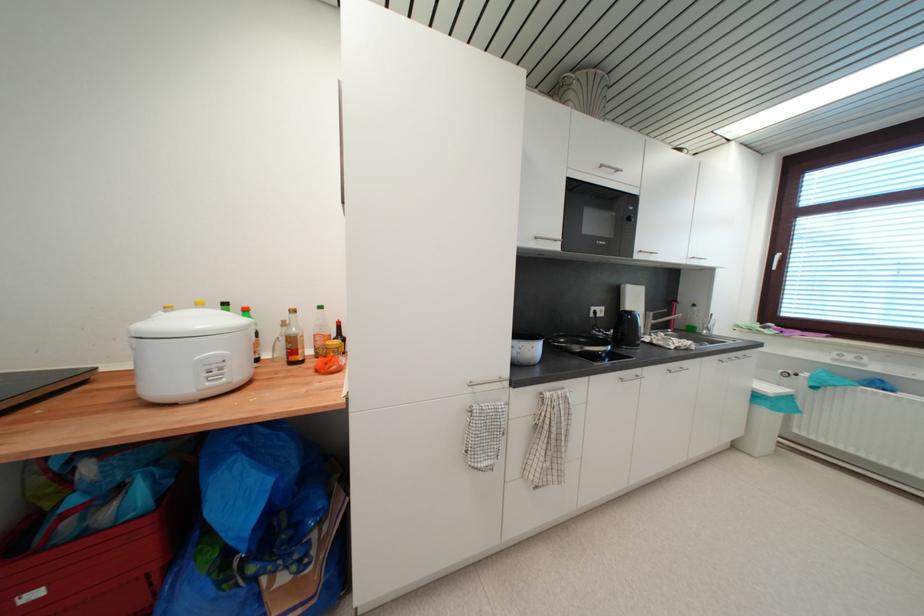
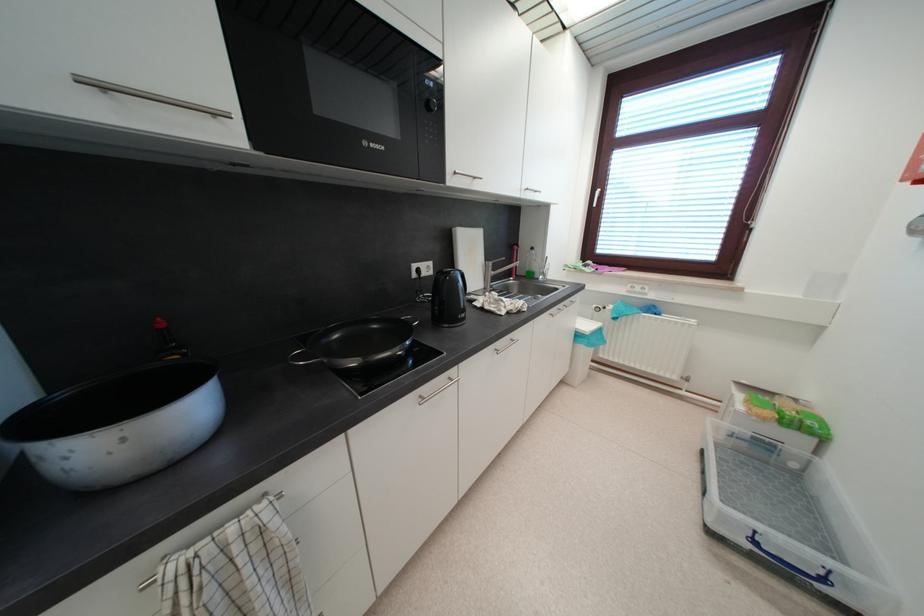
The point at (633, 222) is marked in the first image. Where is the corresponding point in the second image?

(433, 108)